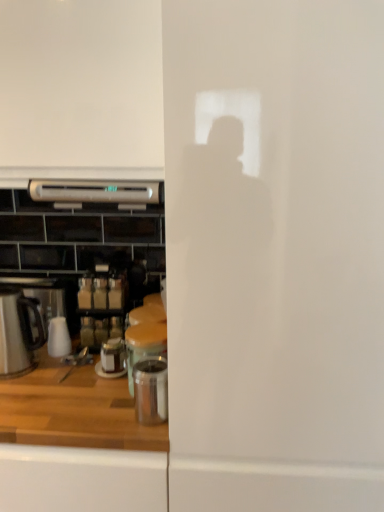
What do you see at coordinates (95, 193) in the screenshot? I see `satin silver microwave at upper center, the second kitchen appliance in the left-to-right sequence` at bounding box center [95, 193].

What do you see at coordinates (81, 84) in the screenshot? The height and width of the screenshot is (512, 384). I see `white glossy microwave at upper left` at bounding box center [81, 84].

What are the coordinates of `polished stainless steel container at lower center, which ranks as the 3th appliance in back-to-front order` in the screenshot? It's located at (151, 390).

Is metallic silver canister at center, which is counted as the second appliance, starting from the front, oriented away from white glossy microwave at upper left?

No, white glossy microwave at upper left is not at the back of metallic silver canister at center, which is counted as the second appliance, starting from the front.

Is metallic silver canister at center, which is counted as the second appliance, starting from the front, to the right of white glossy microwave at upper left from the viewer's perspective?

Yes.

Which is in front, point (127, 342) or point (96, 49)?

Point (96, 49)

Considering the positions of objects metallic glass jar at center, positioned as the 3th appliance in front-to-back order, and satin silver microwave at upper center, the second kitchen appliance in the left-to-right sequence, in the image provided, who is more to the left, metallic glass jar at center, positioned as the 3th appliance in front-to-back order, or satin silver microwave at upper center, the second kitchen appliance in the left-to-right sequence,?

satin silver microwave at upper center, the second kitchen appliance in the left-to-right sequence, is more to the left.

Which is less distant, (117,357) or (101,190)?

The point (101,190) is closer.

From a real-world perspective, between metallic glass jar at center, positioned as the 3th appliance in front-to-back order, and satin silver microwave at upper center, placed as the 1th kitchen appliance when sorted from top to bottom, who is vertically lower?

From a 3D spatial view, metallic glass jar at center, positioned as the 3th appliance in front-to-back order, is below.

Is metallic glass jar at center, positioned as the 3th appliance in front-to-back order, facing away from stainless steel kettle at left, marked as the 2th kitchen appliance in a top-to-bottom arrangement?

metallic glass jar at center, positioned as the 3th appliance in front-to-back order, does not have its back to stainless steel kettle at left, marked as the 2th kitchen appliance in a top-to-bottom arrangement.

From the image's perspective, would you say metallic glass jar at center, positioned as the 3th appliance in front-to-back order, is positioned over stainless steel kettle at left, which is the 1th kitchen appliance in left-to-right order?

No, from the image's perspective, metallic glass jar at center, positioned as the 3th appliance in front-to-back order, is not over stainless steel kettle at left, which is the 1th kitchen appliance in left-to-right order.

Between metallic glass jar at center, positioned as the 3th appliance in front-to-back order, and stainless steel kettle at left, marked as the 2th kitchen appliance in a top-to-bottom arrangement, which one appears on the left side from the viewer's perspective?

Positioned to the left is stainless steel kettle at left, marked as the 2th kitchen appliance in a top-to-bottom arrangement.

How many degrees apart are the facing directions of satin silver microwave at upper center, the second kitchen appliance in the left-to-right sequence, and metallic silver canister at center, which is counted as the second appliance, starting from the front?

The facing directions of satin silver microwave at upper center, the second kitchen appliance in the left-to-right sequence, and metallic silver canister at center, which is counted as the second appliance, starting from the front, are 1.36 degrees apart.

Between satin silver microwave at upper center, the first kitchen appliance when ordered from right to left, and metallic silver canister at center, positioned as the 2th appliance in back-to-front order, which one is positioned behind?

satin silver microwave at upper center, the first kitchen appliance when ordered from right to left, is more distant.

Considering the positions of objects satin silver microwave at upper center, marked as the second kitchen appliance in a bottom-to-top arrangement, and metallic silver canister at center, which is counted as the second appliance, starting from the front, in the image provided, who is more to the left, satin silver microwave at upper center, marked as the second kitchen appliance in a bottom-to-top arrangement, or metallic silver canister at center, which is counted as the second appliance, starting from the front,?

satin silver microwave at upper center, marked as the second kitchen appliance in a bottom-to-top arrangement.

From the image's perspective, is satin silver microwave at upper center, the second kitchen appliance in the left-to-right sequence, under metallic silver canister at center, positioned as the 2th appliance in back-to-front order?

Actually, satin silver microwave at upper center, the second kitchen appliance in the left-to-right sequence, appears above metallic silver canister at center, positioned as the 2th appliance in back-to-front order, in the image.

Is stainless steel kettle at left, which is the 1th kitchen appliance in left-to-right order, facing towards satin silver microwave at upper center, marked as the second kitchen appliance in a bottom-to-top arrangement?

No, stainless steel kettle at left, which is the 1th kitchen appliance in left-to-right order, is not facing towards satin silver microwave at upper center, marked as the second kitchen appliance in a bottom-to-top arrangement.

Does stainless steel kettle at left, acting as the 1th kitchen appliance starting from the bottom, appear on the left side of satin silver microwave at upper center, marked as the second kitchen appliance in a bottom-to-top arrangement?

Correct, you'll find stainless steel kettle at left, acting as the 1th kitchen appliance starting from the bottom, to the left of satin silver microwave at upper center, marked as the second kitchen appliance in a bottom-to-top arrangement.

Considering the points (12, 345) and (32, 193), which point is behind, point (12, 345) or point (32, 193)?

The point (12, 345) is farther.

Is stainless steel kettle at left, placed as the 2th kitchen appliance when sorted from right to left, shorter than satin silver microwave at upper center, marked as the second kitchen appliance in a bottom-to-top arrangement?

In fact, stainless steel kettle at left, placed as the 2th kitchen appliance when sorted from right to left, may be taller than satin silver microwave at upper center, marked as the second kitchen appliance in a bottom-to-top arrangement.

Is polished stainless steel container at lower center, which is the 1th appliance from front to back, not within stainless steel kettle at left, marked as the 2th kitchen appliance in a top-to-bottom arrangement?

Indeed, polished stainless steel container at lower center, which is the 1th appliance from front to back, is completely outside stainless steel kettle at left, marked as the 2th kitchen appliance in a top-to-bottom arrangement.

What's the angular difference between polished stainless steel container at lower center, which ranks as the 3th appliance in back-to-front order, and stainless steel kettle at left, acting as the 1th kitchen appliance starting from the bottom,'s facing directions?

4 degrees.

Is polished stainless steel container at lower center, which ranks as the 3th appliance in back-to-front order, looking in the opposite direction of stainless steel kettle at left, acting as the 1th kitchen appliance starting from the bottom?

No, polished stainless steel container at lower center, which ranks as the 3th appliance in back-to-front order, is not facing the opposite direction of stainless steel kettle at left, acting as the 1th kitchen appliance starting from the bottom.

Would you consider polished stainless steel container at lower center, which ranks as the 3th appliance in back-to-front order, to be distant from stainless steel kettle at left, marked as the 2th kitchen appliance in a top-to-bottom arrangement?

No.

Considering the relative positions of satin silver microwave at upper center, the second kitchen appliance in the left-to-right sequence, and polished stainless steel container at lower center, which is the 1th appliance from front to back, in the image provided, is satin silver microwave at upper center, the second kitchen appliance in the left-to-right sequence, to the right of polished stainless steel container at lower center, which is the 1th appliance from front to back, from the viewer's perspective?

In fact, satin silver microwave at upper center, the second kitchen appliance in the left-to-right sequence, is to the left of polished stainless steel container at lower center, which is the 1th appliance from front to back.

Considering the relative sizes of satin silver microwave at upper center, the second kitchen appliance in the left-to-right sequence, and polished stainless steel container at lower center, which is the 1th appliance from front to back, in the image provided, is satin silver microwave at upper center, the second kitchen appliance in the left-to-right sequence, thinner than polished stainless steel container at lower center, which is the 1th appliance from front to back,?

No, satin silver microwave at upper center, the second kitchen appliance in the left-to-right sequence, is not thinner than polished stainless steel container at lower center, which is the 1th appliance from front to back.

Considering the relative sizes of satin silver microwave at upper center, the first kitchen appliance when ordered from right to left, and polished stainless steel container at lower center, which is the 1th appliance from front to back, in the image provided, is satin silver microwave at upper center, the first kitchen appliance when ordered from right to left, bigger than polished stainless steel container at lower center, which is the 1th appliance from front to back,?

Indeed, satin silver microwave at upper center, the first kitchen appliance when ordered from right to left, has a larger size compared to polished stainless steel container at lower center, which is the 1th appliance from front to back.

From the image's perspective, is satin silver microwave at upper center, marked as the second kitchen appliance in a bottom-to-top arrangement, over polished stainless steel container at lower center, which is the 1th appliance from front to back?

Yes, from the image's perspective, satin silver microwave at upper center, marked as the second kitchen appliance in a bottom-to-top arrangement, is on top of polished stainless steel container at lower center, which is the 1th appliance from front to back.

I want to click on home appliance located above the metallic silver canister at center, which is counted as the second appliance, starting from the front (from a real-world perspective), so click(81, 84).

Image resolution: width=384 pixels, height=512 pixels. In order to click on the 2nd kitchen appliance above the metallic glass jar at center, which is counted as the first appliance, starting from the back (from the image's perspective) in this screenshot , I will do `click(95, 193)`.

Looking at this image, from the image, which object appears to be farther from polished stainless steel container at lower center, which ranks as the 3th appliance in back-to-front order, metallic glass jar at center, which is counted as the first appliance, starting from the back, or metallic silver canister at center, positioned as the 2th appliance in back-to-front order?

The object further to polished stainless steel container at lower center, which ranks as the 3th appliance in back-to-front order, is metallic glass jar at center, which is counted as the first appliance, starting from the back.

Based on their spatial positions, is stainless steel kettle at left, marked as the 2th kitchen appliance in a top-to-bottom arrangement, or satin silver microwave at upper center, the second kitchen appliance in the left-to-right sequence, closer to metallic glass jar at center, positioned as the 3th appliance in front-to-back order?

Among the two, stainless steel kettle at left, marked as the 2th kitchen appliance in a top-to-bottom arrangement, is located nearer to metallic glass jar at center, positioned as the 3th appliance in front-to-back order.

Which object lies further to the anchor point metallic glass jar at center, which is counted as the first appliance, starting from the back, polished stainless steel container at lower center, which is the 1th appliance from front to back, or stainless steel kettle at left, which is the 1th kitchen appliance in left-to-right order?

Based on the image, stainless steel kettle at left, which is the 1th kitchen appliance in left-to-right order, appears to be further to metallic glass jar at center, which is counted as the first appliance, starting from the back.

Consider the image. Estimate the real-world distances between objects in this image. Which object is closer to polished stainless steel container at lower center, which ranks as the 3th appliance in back-to-front order, satin silver microwave at upper center, the second kitchen appliance in the left-to-right sequence, or stainless steel kettle at left, placed as the 2th kitchen appliance when sorted from right to left?

The object closer to polished stainless steel container at lower center, which ranks as the 3th appliance in back-to-front order, is stainless steel kettle at left, placed as the 2th kitchen appliance when sorted from right to left.

Looking at the image, which one is located closer to metallic glass jar at center, positioned as the 3th appliance in front-to-back order, stainless steel kettle at left, which is the 1th kitchen appliance in left-to-right order, or white glossy microwave at upper left?

Based on the image, stainless steel kettle at left, which is the 1th kitchen appliance in left-to-right order, appears to be nearer to metallic glass jar at center, positioned as the 3th appliance in front-to-back order.

Looking at the image, which one is located closer to metallic glass jar at center, positioned as the 3th appliance in front-to-back order, polished stainless steel container at lower center, which is the 1th appliance from front to back, or metallic silver canister at center, which is counted as the second appliance, starting from the front?

metallic silver canister at center, which is counted as the second appliance, starting from the front, is positioned closer to the anchor metallic glass jar at center, positioned as the 3th appliance in front-to-back order.

Based on their spatial positions, is stainless steel kettle at left, which is the 1th kitchen appliance in left-to-right order, or satin silver microwave at upper center, marked as the second kitchen appliance in a bottom-to-top arrangement, further from metallic silver canister at center, positioned as the 2th appliance in back-to-front order?

Among the two, satin silver microwave at upper center, marked as the second kitchen appliance in a bottom-to-top arrangement, is located further to metallic silver canister at center, positioned as the 2th appliance in back-to-front order.

When comparing their distances from metallic glass jar at center, positioned as the 3th appliance in front-to-back order, does metallic silver canister at center, which is counted as the second appliance, starting from the front, or polished stainless steel container at lower center, which is the 1th appliance from front to back, seem further?

polished stainless steel container at lower center, which is the 1th appliance from front to back, lies further to metallic glass jar at center, positioned as the 3th appliance in front-to-back order, than the other object.

Where is `appliance that lies between white glossy microwave at upper left and metallic glass jar at center, positioned as the 3th appliance in front-to-back order, from top to bottom`? Image resolution: width=384 pixels, height=512 pixels. appliance that lies between white glossy microwave at upper left and metallic glass jar at center, positioned as the 3th appliance in front-to-back order, from top to bottom is located at coordinates (144, 345).

Find the location of a particular element. Image resolution: width=384 pixels, height=512 pixels. kitchen appliance between satin silver microwave at upper center, the first kitchen appliance when ordered from right to left, and polished stainless steel container at lower center, which ranks as the 3th appliance in back-to-front order, vertically is located at coordinates (18, 332).

Where is `kitchen appliance that lies between satin silver microwave at upper center, placed as the 1th kitchen appliance when sorted from top to bottom, and metallic silver canister at center, positioned as the 2th appliance in back-to-front order, from top to bottom`? The width and height of the screenshot is (384, 512). kitchen appliance that lies between satin silver microwave at upper center, placed as the 1th kitchen appliance when sorted from top to bottom, and metallic silver canister at center, positioned as the 2th appliance in back-to-front order, from top to bottom is located at coordinates (18, 332).

This screenshot has height=512, width=384. Identify the location of kitchen appliance between white glossy microwave at upper left and stainless steel kettle at left, which is the 1th kitchen appliance in left-to-right order, vertically. (95, 193).